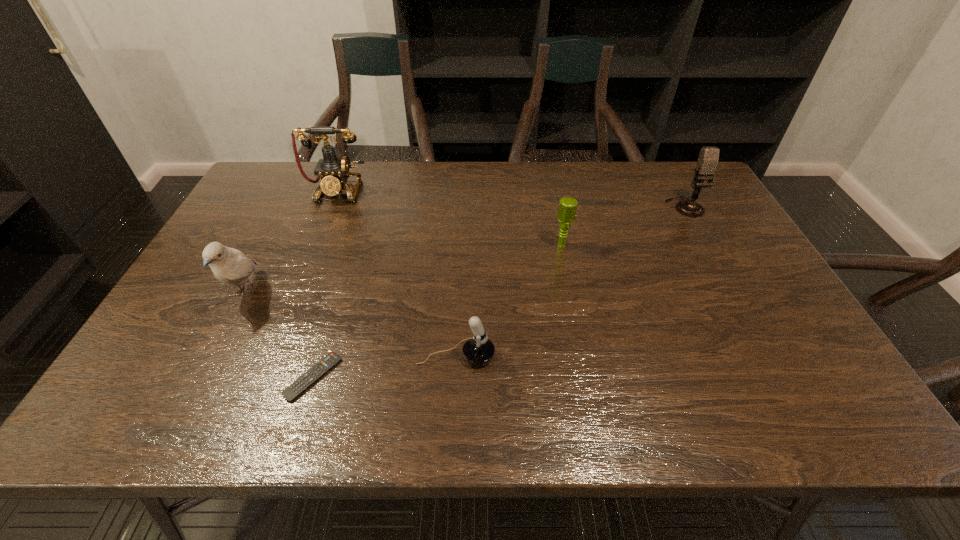
Identify the location of telephone. Image resolution: width=960 pixels, height=540 pixels. (334, 172).

Identify the location of the rightmost object. (708, 158).

I want to click on the tallest microphone, so click(x=708, y=158).

Locate an element on the screen. bird is located at coordinates (230, 266).

The height and width of the screenshot is (540, 960). I want to click on the second object from right to left, so click(567, 208).

Where is `the fourth nearest object`? This screenshot has height=540, width=960. the fourth nearest object is located at coordinates (567, 208).

Locate an element on the screen. the fifth tallest object is located at coordinates (478, 350).

The image size is (960, 540). I want to click on the fourth object from left to right, so click(478, 350).

Find the location of a particular element. The image size is (960, 540). remote control is located at coordinates (291, 393).

Identify the location of free region located 0.290m on the front of the telephone, featuring the rotary dial. (306, 268).